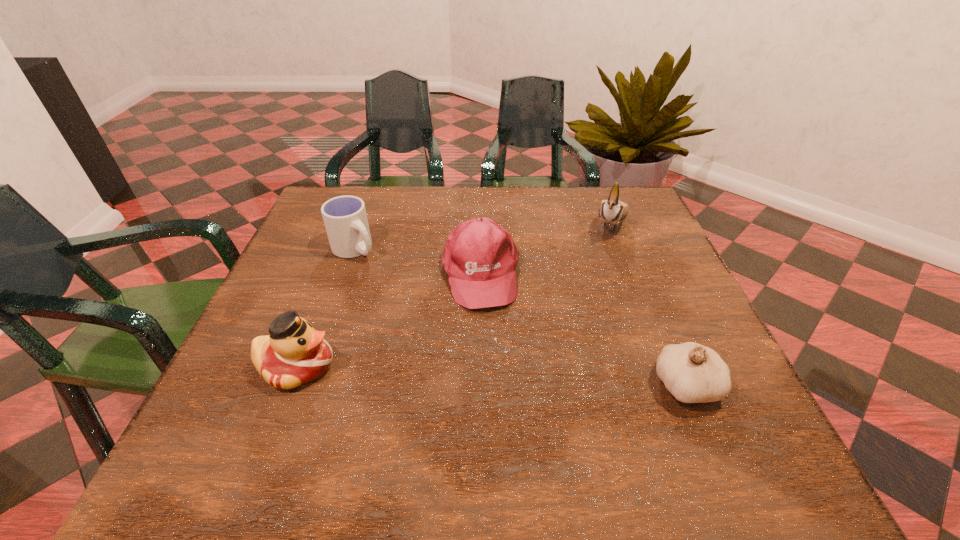
The image size is (960, 540). Identify the location of blank region between the third object from left to right and the cup. click(418, 261).

You are a GUI agent. You are given a task and a screenshot of the screen. Output one action in this format:
    pyautogui.click(x=<x>, y=<y>)
    Task: Click on the vacant area that lies between the baseball cap and the bird
    The width and height of the screenshot is (960, 540).
    Given the screenshot: What is the action you would take?
    pyautogui.click(x=545, y=249)

Find the location of a particular element. The height and width of the screenshot is (540, 960). free spot between the garlic and the cup is located at coordinates pyautogui.click(x=520, y=318).

Identify the location of free space between the third object from left to right and the garlic. (584, 329).

This screenshot has height=540, width=960. I want to click on unoccupied position between the garlic and the third object from right to left, so click(x=584, y=329).

Where is `free spot between the cup and the garlic`? The width and height of the screenshot is (960, 540). free spot between the cup and the garlic is located at coordinates (520, 318).

You are a GUI agent. You are given a task and a screenshot of the screen. Output one action in this format:
    pyautogui.click(x=<x>, y=<y>)
    Task: Click on the free space between the garlic and the duck
    This screenshot has height=540, width=960.
    Given the screenshot: What is the action you would take?
    pyautogui.click(x=492, y=376)

The width and height of the screenshot is (960, 540). I want to click on object that is the third closest to the baseball cap, so click(x=613, y=210).

You are a GUI agent. You are given a task and a screenshot of the screen. Output one action in this format:
    pyautogui.click(x=<x>, y=<y>)
    Task: Click on the object that is the closest to the garlic
    This screenshot has height=540, width=960.
    Given the screenshot: What is the action you would take?
    pyautogui.click(x=480, y=258)

Locate an element on the screen. The width and height of the screenshot is (960, 540). free location that satisfies the following two spatial constraints: 1. on the front side of the garlic; 2. on the right side of the tallest object is located at coordinates (674, 386).